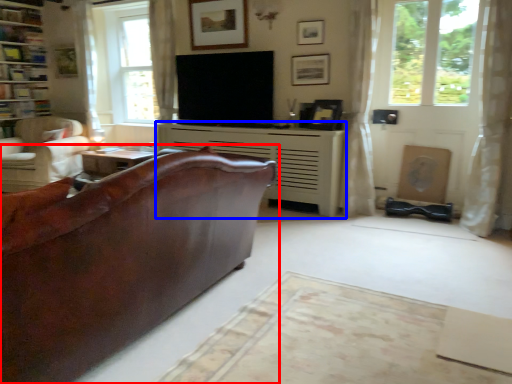
Question: Which of the following is the closest to the observer, studio couch (highlighted by a red box) or fireplace (highlighted by a blue box)?

Choices:
 (A) studio couch
 (B) fireplace

Answer: (A)